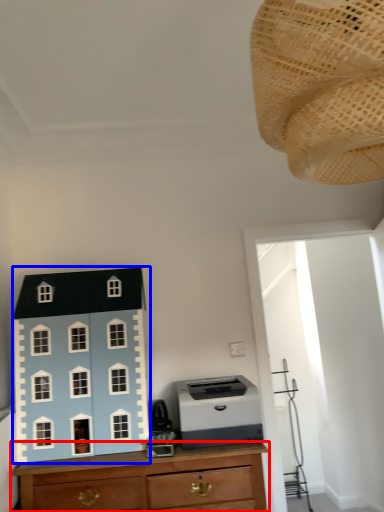
Question: Which object is closer to the camera taking this photo, chest of drawers (highlighted by a red box) or toy (highlighted by a blue box)?

Choices:
 (A) chest of drawers
 (B) toy

Answer: (A)